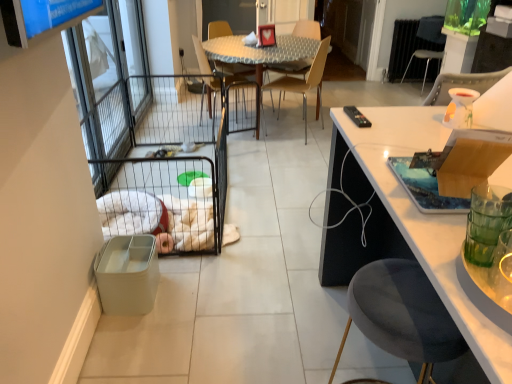
Question: Can you confirm if light brown wood chair at center, the 2th chair viewed from the left, is smaller than metallic silver chair at upper right, arranged as the 4th chair when viewed from the front?

Choices:
 (A) no
 (B) yes

Answer: (B)

Question: Is light brown wood chair at center, marked as the 2th chair in a bottom-to-top arrangement, positioned with its back to metallic silver chair at upper right, which is the 4th chair in bottom-to-top order?

Choices:
 (A) no
 (B) yes

Answer: (A)

Question: Considering the relative positions of light brown wood chair at center, the 2th chair viewed from the left, and metallic silver chair at upper right, the first chair in the back-to-front sequence, in the image provided, is light brown wood chair at center, the 2th chair viewed from the left, to the right of metallic silver chair at upper right, the first chair in the back-to-front sequence, from the viewer's perspective?

Choices:
 (A) yes
 (B) no

Answer: (B)

Question: Does light brown wood chair at center, which ranks as the second chair in front-to-back order, have a larger size compared to metallic silver chair at upper right, the first chair in the back-to-front sequence?

Choices:
 (A) yes
 (B) no

Answer: (B)

Question: Considering the relative sizes of light brown wood chair at center, marked as the 2th chair in a bottom-to-top arrangement, and metallic silver chair at upper right, which is the 1th chair in right-to-left order, in the image provided, is light brown wood chair at center, marked as the 2th chair in a bottom-to-top arrangement, shorter than metallic silver chair at upper right, which is the 1th chair in right-to-left order,?

Choices:
 (A) no
 (B) yes

Answer: (A)

Question: Is point (429, 21) positioned closer to the camera than point (140, 289)?

Choices:
 (A) farther
 (B) closer

Answer: (A)

Question: Is metallic silver chair at upper right, marked as the first chair in a top-to-bottom arrangement, situated inside matte plastic trash bin at lower left or outside?

Choices:
 (A) outside
 (B) inside

Answer: (A)

Question: From the image's perspective, is metallic silver chair at upper right, the first chair in the back-to-front sequence, located above or below matte plastic trash bin at lower left?

Choices:
 (A) above
 (B) below

Answer: (A)

Question: Based on their sizes in the image, would you say metallic silver chair at upper right, marked as the first chair in a top-to-bottom arrangement, is bigger or smaller than matte plastic trash bin at lower left?

Choices:
 (A) big
 (B) small

Answer: (A)

Question: From the image's perspective, is metallic silver chair at center, the first chair when ordered from left to right, located above or below metallic silver chair at upper right, arranged as the 4th chair when viewed from the left?

Choices:
 (A) above
 (B) below

Answer: (B)

Question: Considering the positions of point (203, 64) and point (437, 41), is point (203, 64) closer or farther from the camera than point (437, 41)?

Choices:
 (A) closer
 (B) farther

Answer: (A)

Question: Is metallic silver chair at center, acting as the fourth chair starting from the right, situated inside metallic silver chair at upper right, the first chair in the back-to-front sequence, or outside?

Choices:
 (A) inside
 (B) outside

Answer: (B)

Question: From a real-world perspective, relative to metallic silver chair at upper right, the first chair in the back-to-front sequence, is metallic silver chair at center, acting as the fourth chair starting from the right, vertically above or below?

Choices:
 (A) below
 (B) above

Answer: (B)

Question: Relative to wooden cutting board at right, is clear glass screen door at left in front or behind?

Choices:
 (A) behind
 (B) front

Answer: (A)

Question: From a real-world perspective, is clear glass screen door at left above or below wooden cutting board at right?

Choices:
 (A) above
 (B) below

Answer: (B)